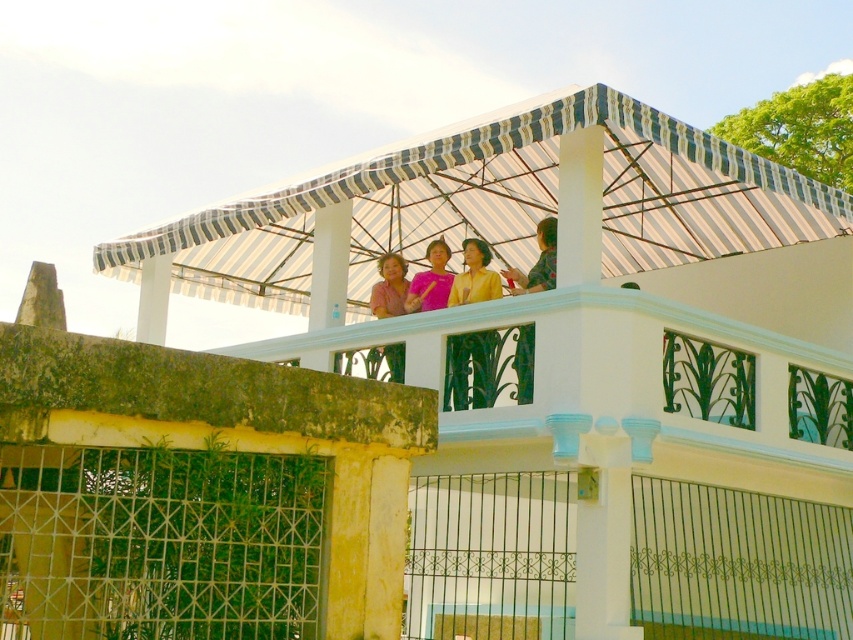
Question: Considering the relative positions of white painted concrete balcony at upper center and floral fabric shirt at upper right in the image provided, where is white painted concrete balcony at upper center located with respect to floral fabric shirt at upper right?

Choices:
 (A) below
 (B) above

Answer: (A)

Question: Which object appears farthest from the camera in this image?

Choices:
 (A) pink fabric at upper center
 (B) white striped awning at center

Answer: (A)

Question: Can you confirm if yellow matte blouse at center is wider than pink fabric at upper center?

Choices:
 (A) yes
 (B) no

Answer: (A)

Question: Is white painted concrete balcony at upper center wider than floral fabric shirt at upper right?

Choices:
 (A) no
 (B) yes

Answer: (A)

Question: Considering the real-world distances, which object is closest to the white striped awning at center?

Choices:
 (A) yellow matte blouse at center
 (B) white painted concrete balcony at upper center
 (C) floral fabric shirt at upper right

Answer: (A)

Question: Which of these objects is positioned farthest from the white striped awning at center?

Choices:
 (A) floral fabric shirt at upper right
 (B) yellow matte blouse at center
 (C) white painted concrete balcony at upper center
 (D) pink fabric at upper center

Answer: (C)